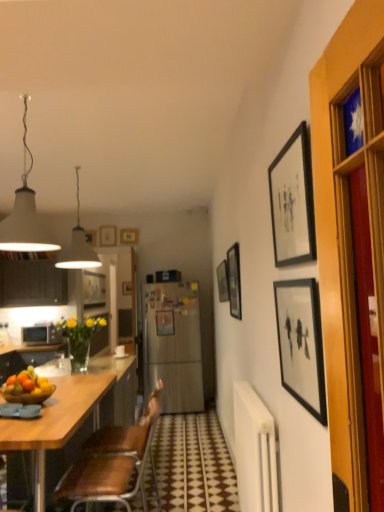
The height and width of the screenshot is (512, 384). Describe the element at coordinates (223, 281) in the screenshot. I see `matte black picture frame at upper center, the fourth picture frame viewed from the right` at that location.

What do you see at coordinates (41, 334) in the screenshot? The height and width of the screenshot is (512, 384). I see `matte silver microwave at left` at bounding box center [41, 334].

The height and width of the screenshot is (512, 384). What do you see at coordinates (77, 245) in the screenshot?
I see `white matte pendant light at upper center, which is counted as the second lamp, starting from the front` at bounding box center [77, 245].

What do you see at coordinates (234, 281) in the screenshot? I see `matte black picture frame at upper center, which ranks as the third picture frame in right-to-left order` at bounding box center [234, 281].

Find the location of `wooden picture frame at upper center, arranged as the 6th picture frame when viewed from the right`. wooden picture frame at upper center, arranged as the 6th picture frame when viewed from the right is located at coordinates (129, 236).

You are a GUI agent. You are given a task and a screenshot of the screen. Output one action in this format:
    pyautogui.click(x=<x>, y=<y>)
    Task: Click on the matte black picture frame at upper center, which appears as the fourth picture frame when viewed from the left
    The image size is (384, 512).
    Given the screenshot: What is the action you would take?
    pyautogui.click(x=223, y=281)

Is matte black picture frame at center, the fifth picture frame positioned from the right, at the back of wooden picture frame at upper center, which is counted as the second picture frame, starting from the back?

That's not correct — wooden picture frame at upper center, which is counted as the second picture frame, starting from the back, is not looking away from matte black picture frame at center, the fifth picture frame positioned from the right.

Is point (129, 236) positioned in front of point (157, 314)?

No, it is not.

Is wooden picture frame at upper center, arranged as the 6th picture frame when viewed from the right, further to the viewer compared to matte black picture frame at center, which appears as the 3th picture frame when viewed from the left?

Yes, wooden picture frame at upper center, arranged as the 6th picture frame when viewed from the right, is further from the camera.

Can you confirm if matte black picture frame at center, which appears as the 3th picture frame when viewed from the left, is thinner than black matte picture frame at upper right, which appears as the second picture frame when viewed from the right?

Indeed, matte black picture frame at center, which appears as the 3th picture frame when viewed from the left, has a lesser width compared to black matte picture frame at upper right, which appears as the second picture frame when viewed from the right.

Which object is positioned more to the left, matte black picture frame at center, which is counted as the third picture frame, starting from the back, or black matte picture frame at upper right, which appears as the sixth picture frame when viewed from the back?

matte black picture frame at center, which is counted as the third picture frame, starting from the back.

Which of these two, matte black picture frame at center, which is counted as the third picture frame, starting from the back, or black matte picture frame at upper right, the 2th picture frame viewed from the front, stands taller?

black matte picture frame at upper right, the 2th picture frame viewed from the front, is taller.

From the image's perspective, is matte black picture frame at center, which is counted as the third picture frame, starting from the back, positioned above or below black matte picture frame at upper right, the 2th picture frame viewed from the front?

matte black picture frame at center, which is counted as the third picture frame, starting from the back, is situated lower than black matte picture frame at upper right, the 2th picture frame viewed from the front, in the image.

Which point is more forward, (7, 288) or (100, 237)?

Point (7, 288)

Is matte black cabinet at left inside the boundaries of wooden picture frame at upper center, which is the 7th picture frame in right-to-left order, or outside?

matte black cabinet at left lies outside wooden picture frame at upper center, which is the 7th picture frame in right-to-left order.

Based on the photo, would you say matte black cabinet at left is a long distance from wooden picture frame at upper center, which is the 7th picture frame in right-to-left order?

Yes, matte black cabinet at left and wooden picture frame at upper center, which is the 7th picture frame in right-to-left order, are located far from each other.

From the image's perspective, between wooden picture frame at upper center, acting as the first picture frame starting from the back, and brown leather chair at lower left, which one is located above?

wooden picture frame at upper center, acting as the first picture frame starting from the back, is shown above in the image.

Based on their sizes in the image, would you say wooden picture frame at upper center, acting as the first picture frame starting from the back, is bigger or smaller than brown leather chair at lower left?

Considering their sizes, wooden picture frame at upper center, acting as the first picture frame starting from the back, takes up less space than brown leather chair at lower left.

Can you tell me how much wooden picture frame at upper center, which is the seventh picture frame from front to back, and brown leather chair at lower left differ in facing direction?

They differ by 90.7 degrees in their facing directions.

From a real-world perspective, who is located higher, wooden picture frame at upper center, which is the seventh picture frame from front to back, or brown leather chair at lower left?

wooden picture frame at upper center, which is the seventh picture frame from front to back, from a real-world perspective.

From the image's perspective, is black matte picture frame at upper right, the 2th picture frame viewed from the front, above or below matte silver microwave at left?

Clearly, from the image's perspective, black matte picture frame at upper right, the 2th picture frame viewed from the front, is above matte silver microwave at left.

Who is bigger, black matte picture frame at upper right, which appears as the sixth picture frame when viewed from the back, or matte silver microwave at left?

matte silver microwave at left is bigger.

Is black matte picture frame at upper right, the 2th picture frame viewed from the front, completely or partially outside of matte silver microwave at left?

black matte picture frame at upper right, the 2th picture frame viewed from the front, is positioned outside matte silver microwave at left.

Is black matte picture frame at upper right, positioned as the 6th picture frame in left-to-right order, oriented away from matte black picture frame at center, the fifth picture frame positioned from the right?

That's not correct — black matte picture frame at upper right, positioned as the 6th picture frame in left-to-right order, is not looking away from matte black picture frame at center, the fifth picture frame positioned from the right.

Can you confirm if black matte picture frame at upper right, which appears as the second picture frame when viewed from the right, is positioned to the left of matte black picture frame at center, which appears as the 3th picture frame when viewed from the left?

No.

From the image's perspective, between black matte picture frame at upper right, positioned as the 6th picture frame in left-to-right order, and matte black picture frame at center, which is counted as the third picture frame, starting from the back, which one is located above?

black matte picture frame at upper right, positioned as the 6th picture frame in left-to-right order, appears higher in the image.

Is black matte picture frame at upper right, which appears as the sixth picture frame when viewed from the back, wider or thinner than matte black picture frame at center, the fifth picture frame in the front-to-back sequence?

In the image, black matte picture frame at upper right, which appears as the sixth picture frame when viewed from the back, appears to be wider than matte black picture frame at center, the fifth picture frame in the front-to-back sequence.

Image resolution: width=384 pixels, height=512 pixels. Identify the location of lamp located below the white matte lampshade at upper left, the second lamp viewed from the back (from the image's perspective). pos(77,245).

Which of these two, white matte pendant light at upper center, the first lamp viewed from the back, or white matte lampshade at upper left, the second lamp viewed from the back, is smaller?

white matte pendant light at upper center, the first lamp viewed from the back.

Between white matte pendant light at upper center, which is counted as the second lamp, starting from the front, and white matte lampshade at upper left, the second lamp viewed from the back, which one has less height?

With less height is white matte pendant light at upper center, which is counted as the second lamp, starting from the front.

This screenshot has width=384, height=512. There is a wooden picture frame at upper center, which is counted as the second picture frame, starting from the back. In order to click on the 5th picture frame below it (from the image's perspective) in this screenshot , I will do `click(165, 322)`.

Where is `the 3rd picture frame counting from the left of the black matte picture frame at upper right, which appears as the sixth picture frame when viewed from the back`? The image size is (384, 512). the 3rd picture frame counting from the left of the black matte picture frame at upper right, which appears as the sixth picture frame when viewed from the back is located at coordinates (165, 322).

Estimate the real-world distances between objects in this image. Which object is closer to white matte lampshade at upper left, the second lamp viewed from the back, matte black cabinet at left or white matte pendant light at upper center, the first lamp viewed from the back?

Based on the image, white matte pendant light at upper center, the first lamp viewed from the back, appears to be nearer to white matte lampshade at upper left, the second lamp viewed from the back.

From the image, which object appears to be nearer to black matte picture frame at right, which is the seventh picture frame in left-to-right order, matte black picture frame at center, the fifth picture frame positioned from the right, or wooden picture frame at upper center, which is the seventh picture frame from front to back?

The object closer to black matte picture frame at right, which is the seventh picture frame in left-to-right order, is matte black picture frame at center, the fifth picture frame positioned from the right.

Considering their positions, is matte black picture frame at center, which is counted as the third picture frame, starting from the back, positioned closer to wooden picture frame at upper center, which is counted as the sixth picture frame, starting from the front, than white matte lampshade at upper left, arranged as the first lamp when viewed from the front?

The object closer to wooden picture frame at upper center, which is counted as the sixth picture frame, starting from the front, is matte black picture frame at center, which is counted as the third picture frame, starting from the back.

Estimate the real-world distances between objects in this image. Which object is further from white matte pendant light at upper center, the first lamp viewed from the back, matte black picture frame at center, the fifth picture frame in the front-to-back sequence, or matte black picture frame at upper center, the 3th picture frame in the front-to-back sequence?

matte black picture frame at center, the fifth picture frame in the front-to-back sequence, is positioned further to the anchor white matte pendant light at upper center, the first lamp viewed from the back.

Based on their spatial positions, is wooden picture frame at upper center, the second picture frame positioned from the left, or matte black cabinet at left closer to wooden picture frame at upper center, which is the 1th picture frame in left-to-right order?

wooden picture frame at upper center, the second picture frame positioned from the left, is positioned closer to the anchor wooden picture frame at upper center, which is the 1th picture frame in left-to-right order.

Estimate the real-world distances between objects in this image. Which object is further from black matte picture frame at upper right, positioned as the 6th picture frame in left-to-right order, matte black picture frame at center, which appears as the 3th picture frame when viewed from the left, or matte black picture frame at upper center, which appears as the fifth picture frame when viewed from the back?

matte black picture frame at center, which appears as the 3th picture frame when viewed from the left.

When comparing their distances from matte black cabinet at left, does matte black picture frame at center, the fifth picture frame positioned from the right, or black matte picture frame at upper right, the 2th picture frame viewed from the front, seem closer?

matte black picture frame at center, the fifth picture frame positioned from the right, lies closer to matte black cabinet at left than the other object.

When comparing their distances from matte black cabinet at left, does matte black picture frame at center, the fifth picture frame positioned from the right, or matte black picture frame at upper center, which appears as the fifth picture frame when viewed from the back, seem further?

Based on the image, matte black picture frame at upper center, which appears as the fifth picture frame when viewed from the back, appears to be further to matte black cabinet at left.

Locate an element on the screen. The width and height of the screenshot is (384, 512). kitchen appliance between white matte lampshade at upper left, arranged as the first lamp when viewed from the front, and wooden picture frame at upper center, which is the seventh picture frame from front to back, in the front-back direction is located at coordinates (41, 334).

I want to click on chair located between black matte picture frame at upper right, which appears as the second picture frame when viewed from the right, and matte black cabinet at left in the depth direction, so click(x=113, y=462).

At what (x,y) coordinates should I click in order to perform the action: click on lamp between black matte picture frame at right, arranged as the 7th picture frame when viewed from the back, and matte black picture frame at upper center, which appears as the 5th picture frame when viewed from the left, in the front-back direction. Please return your answer as a coordinate pair (x, y). Looking at the image, I should click on (25, 214).

Where is `picture frame between matte black picture frame at upper center, which appears as the fourth picture frame when viewed from the left, and wooden picture frame at upper center, the second picture frame positioned from the left, from front to back`? picture frame between matte black picture frame at upper center, which appears as the fourth picture frame when viewed from the left, and wooden picture frame at upper center, the second picture frame positioned from the left, from front to back is located at coordinates (165, 322).